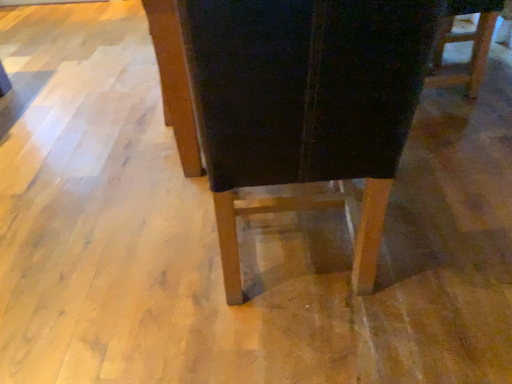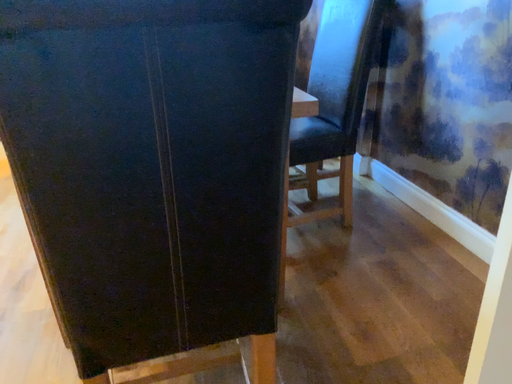
Question: How did the camera likely rotate when shooting the video?

Choices:
 (A) rotated upward
 (B) rotated downward

Answer: (A)